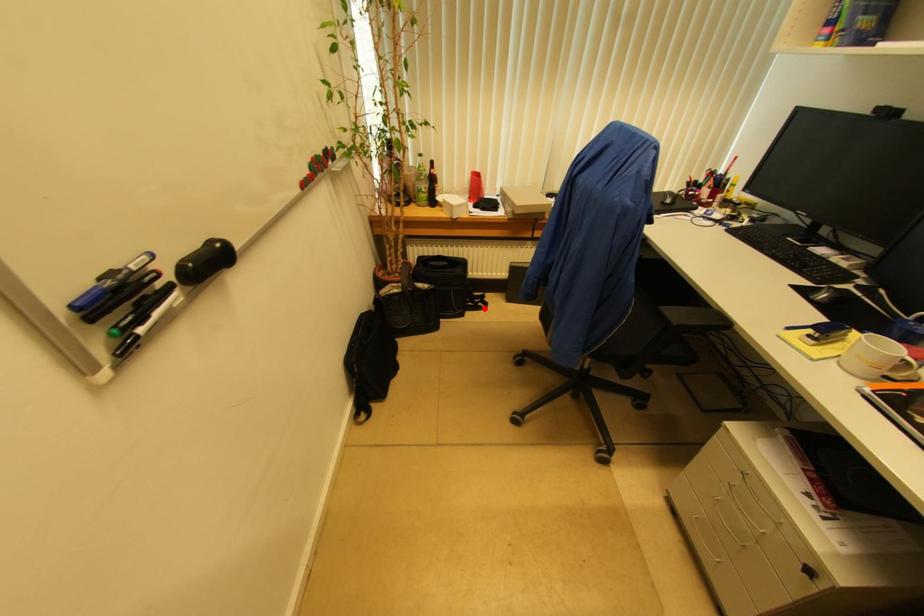
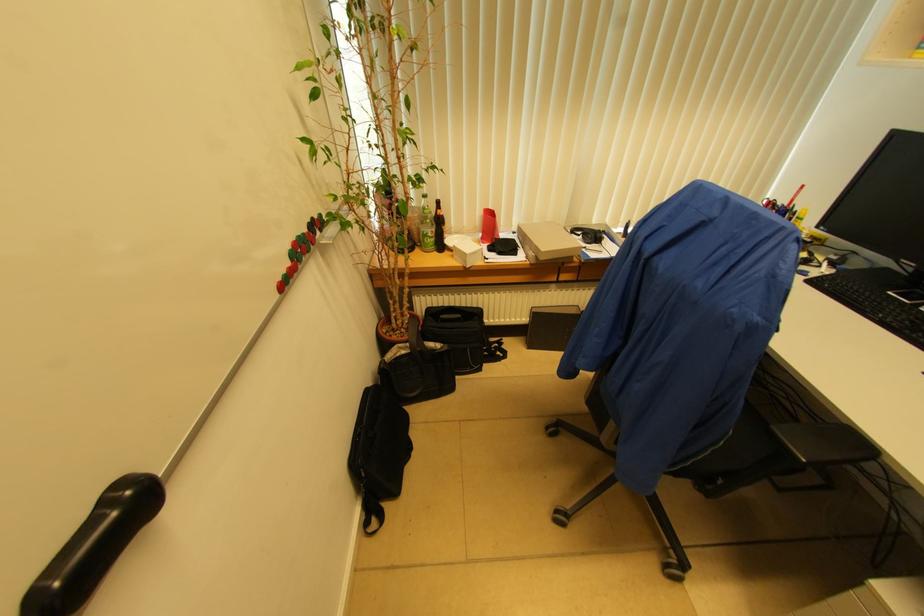
Question: I am providing you with two images of the same scene from different viewpoints. A red point is marked on the first image. At the location where the point appears in image 1, is it still visible in image 2?

Choices:
 (A) Yes
 (B) No

Answer: (A)